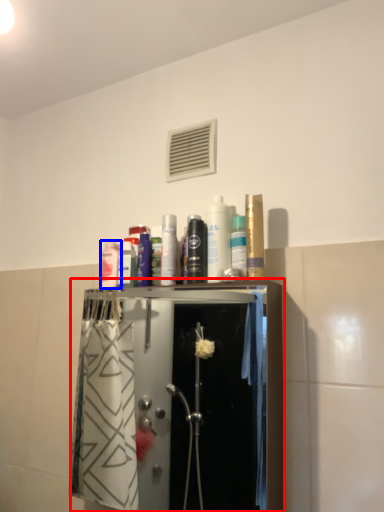
Question: Which object appears farthest to the camera in this image, closet (highlighted by a red box) or toiletry (highlighted by a blue box)?

Choices:
 (A) closet
 (B) toiletry

Answer: (B)